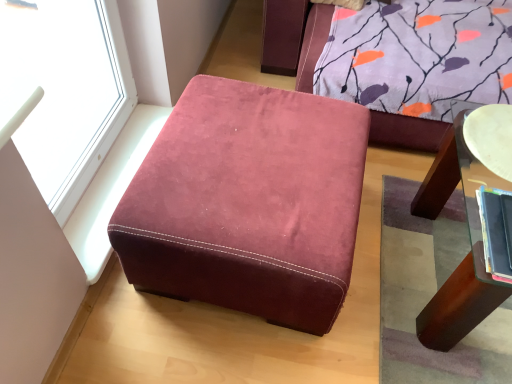
Find the location of a particular element. The width and height of the screenshot is (512, 384). vacant space underneath transparent glass window at upper left (from a real-world perspective) is located at coordinates (103, 168).